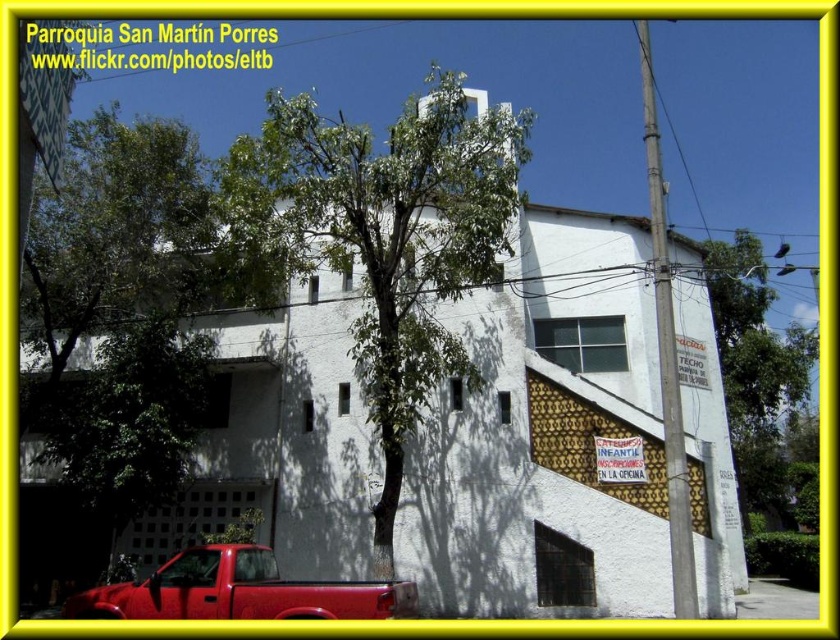
Is green leafy tree at center to the left of shiny red truck at lower left from the viewer's perspective?

Indeed, green leafy tree at center is positioned on the left side of shiny red truck at lower left.

Who is higher up, green leafy tree at center or shiny red truck at lower left?

green leafy tree at center is higher up.

Does point (449, 193) come in front of point (277, 604)?

No.

Locate an element on the screen. green leafy tree at center is located at coordinates (384, 237).

Is point (739, 387) closer to camera compared to point (281, 614)?

No, (739, 387) is behind (281, 614).

Is green leafy tree at right positioned before shiny red truck at lower left?

No, green leafy tree at right is behind shiny red truck at lower left.

Describe the element at coordinates (756, 374) in the screenshot. I see `green leafy tree at right` at that location.

Where is `green leafy tree at right`? This screenshot has height=640, width=840. green leafy tree at right is located at coordinates (756, 374).

Between green leafy tree at center and green leafy tree at right, which one appears on the right side from the viewer's perspective?

green leafy tree at right

Does green leafy tree at center appear on the right side of green leafy tree at right?

In fact, green leafy tree at center is to the left of green leafy tree at right.

At what (x,y) coordinates should I click in order to perform the action: click on green leafy tree at center. Please return your answer as a coordinate pair (x, y). The width and height of the screenshot is (840, 640). Looking at the image, I should click on (384, 237).